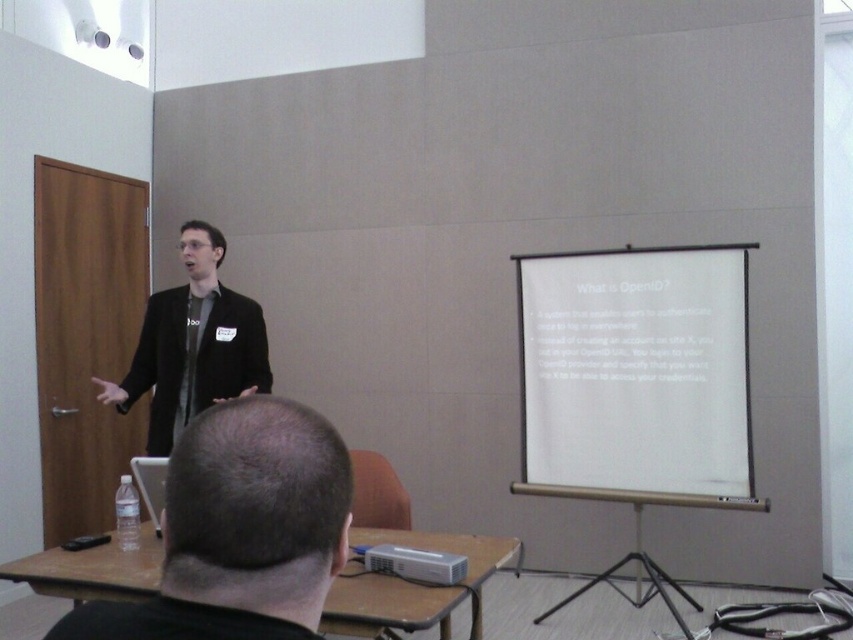
You are a photographer taking a photo of the presentation. The black hair at upper center is blocking part of the screen. To avoid capturing it, where should you adjust your camera? Please provide coordinates in the format of x and y between 0 and 1, where the origin is the bottom left corner of the image.

The black hair at upper center is located at coordinates x 0.830 and y 0.283. To avoid capturing it, adjust the camera to focus slightly below this point, aiming for coordinates around x 0.8 and y 0.2 to ensure the hair is out of frame.

You are an attendee at the presentation and want to take a photo of the white matte projection screen at center right and the black matte suit at center. Which object should you focus on first if you want to capture both in the same frame?

The white matte projection screen at center right is positioned on the right side of the black matte suit at center, so you should focus on the black matte suit at center first to ensure both are in the same frame.